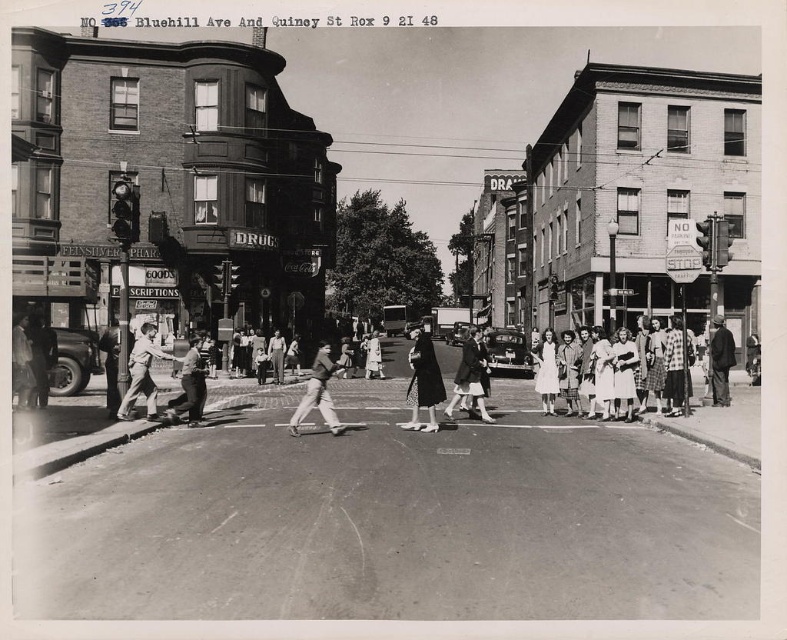
Question: Based on their relative distances, which object is farther from the matte black truck at left?

Choices:
 (A) smooth skin person at center
 (B) shiny black car at center
 (C) shiny silver car at center
 (D) matte black dress at center

Answer: (B)

Question: Does matte black dress at center come behind dark gray suit at center?

Choices:
 (A) no
 (B) yes

Answer: (A)

Question: Which of the following is the farthest from the observer?

Choices:
 (A) (457, 324)
 (B) (54, 332)

Answer: (A)

Question: Observing the image, what is the correct spatial positioning of matte gray suit at center in reference to shiny black car at center?

Choices:
 (A) left
 (B) right

Answer: (A)

Question: In this image, where is matte black dress at center located relative to light brown leather jacket at lower left?

Choices:
 (A) above
 (B) below

Answer: (B)

Question: Which object appears closest to the camera in this image?

Choices:
 (A) matte gray suit at center
 (B) matte black truck at left

Answer: (A)